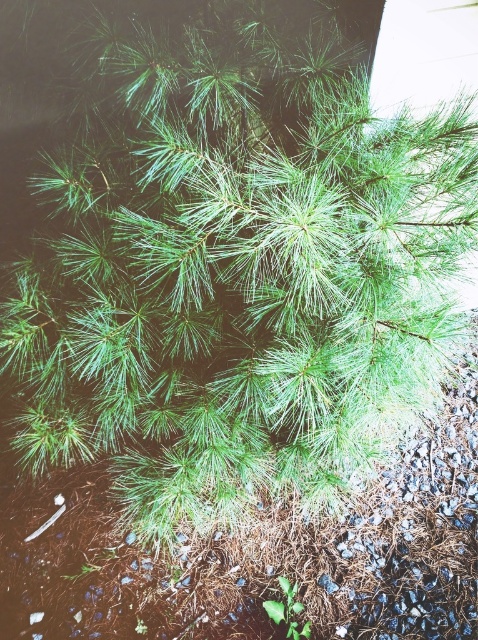
You are a gardener who needs to water both the brown mulch at center and the green leafy plant at bottom. Your watering can has a maximum reach of 40 centimeters. Without moving the watering can, can you water both objects?

The brown mulch at center and green leafy plant at bottom are 40.38 centimeters apart. Since the watering can can only reach 40 centimeters, it is 0.38 centimeters too short to reach both objects without moving the can.

You are standing in front of the pine tree and want to place a small decoration exactly where the brown mulch at center is located. According to the image, what are the coordinates of the location where you should place the decoration?

The coordinates for the brown mulch at center are at point (259, 552).

You are a gardener planning to plant a new flower bed. You observe the brown mulch at center and the green leafy plant at bottom in the scene. Which object takes up more space in the image?

The brown mulch at center is larger in size than the green leafy plant at bottom, so it takes up more space in the image.